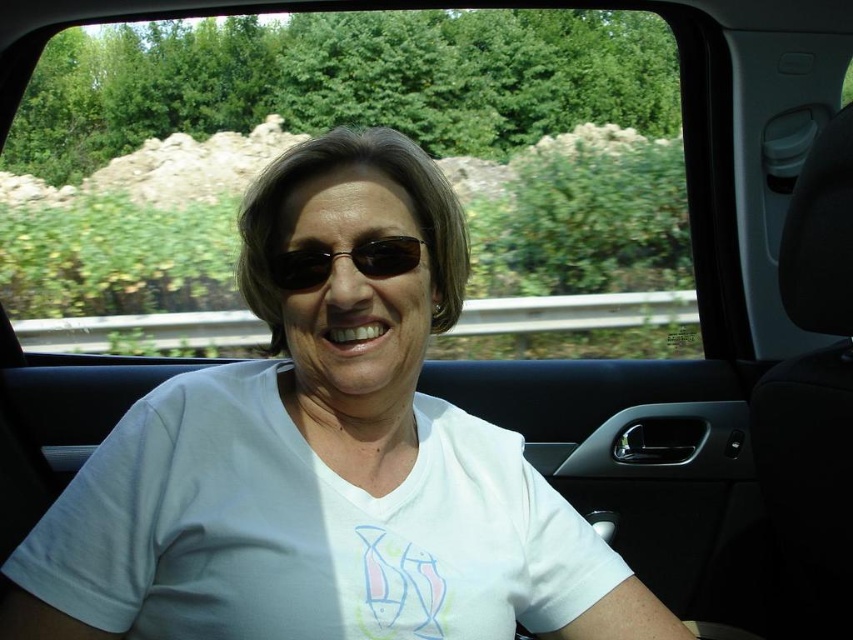
Is transparent glass car window at center below black plastic sunglasses at center?

No, transparent glass car window at center is not below black plastic sunglasses at center.

Find the location of `transparent glass car window at center`. transparent glass car window at center is located at coordinates (355, 124).

Is transparent glass car window at center smaller than white cotton shirt at center?

Incorrect, transparent glass car window at center is not smaller in size than white cotton shirt at center.

Locate an element on the screen. Image resolution: width=853 pixels, height=640 pixels. transparent glass car window at center is located at coordinates (355, 124).

Is white cotton shirt at center to the right of black plastic sunglasses at center from the viewer's perspective?

Yes, white cotton shirt at center is to the right of black plastic sunglasses at center.

Does point (581, 552) come in front of point (401, 259)?

No, it is not.

Image resolution: width=853 pixels, height=640 pixels. Identify the location of white cotton shirt at center. (305, 529).